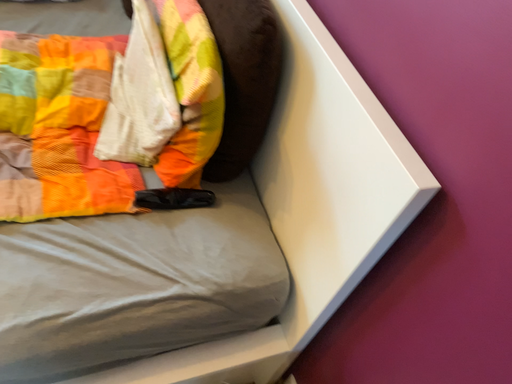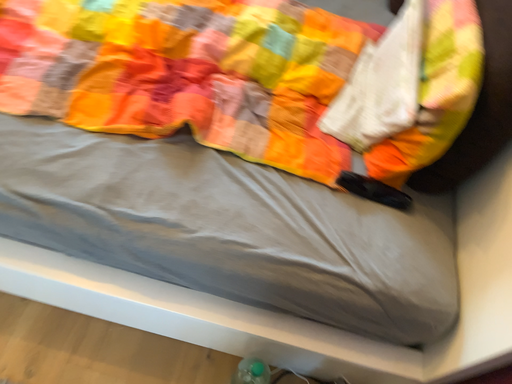
Question: How did the camera likely rotate when shooting the video?

Choices:
 (A) rotated left
 (B) rotated right

Answer: (A)